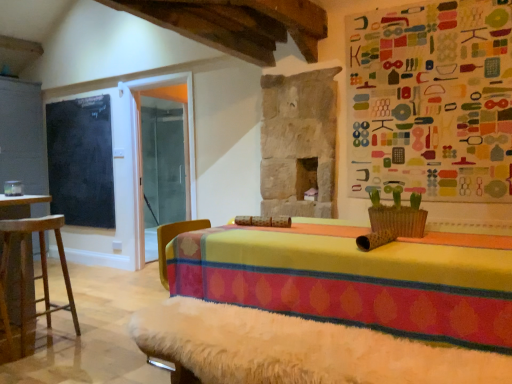
Where is `vacant region to the right of wooden stool at left`? vacant region to the right of wooden stool at left is located at coordinates (84, 341).